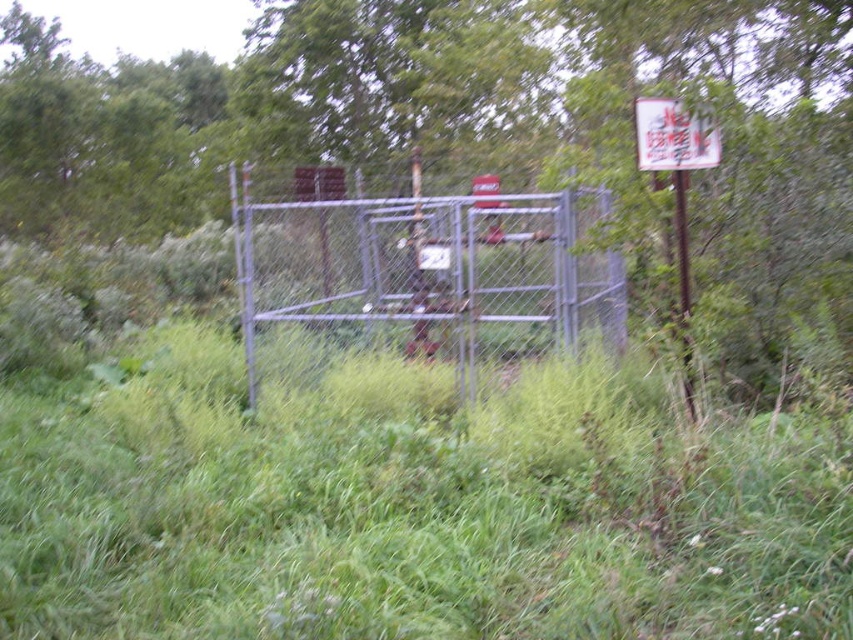
Is green grass at center to the left of metallic chain-link fence at center from the viewer's perspective?

Yes, green grass at center is to the left of metallic chain-link fence at center.

Does green grass at center have a greater height compared to metallic chain-link fence at center?

Indeed, green grass at center has a greater height compared to metallic chain-link fence at center.

Which is behind, point (616, 554) or point (379, 284)?

Point (379, 284)

Locate an element on the screen. The height and width of the screenshot is (640, 853). green grass at center is located at coordinates (415, 508).

Can you confirm if green grass at center is wider than white paper sign at upper right?

Indeed, green grass at center has a greater width compared to white paper sign at upper right.

What do you see at coordinates (415, 508) in the screenshot? This screenshot has width=853, height=640. I see `green grass at center` at bounding box center [415, 508].

At what (x,y) coordinates should I click in order to perform the action: click on green grass at center. Please return your answer as a coordinate pair (x, y). Looking at the image, I should click on (415, 508).

Locate an element on the screen. The height and width of the screenshot is (640, 853). green grass at center is located at coordinates (415, 508).

Looking at this image, between green leafy tree at upper center and metallic chain-link fence at center, which one has less height?

metallic chain-link fence at center is shorter.

Image resolution: width=853 pixels, height=640 pixels. Describe the element at coordinates (454, 115) in the screenshot. I see `green leafy tree at upper center` at that location.

Does point (506, 61) come behind point (556, 292)?

That is True.

You are a GUI agent. You are given a task and a screenshot of the screen. Output one action in this format:
    pyautogui.click(x=<x>, y=<y>)
    Task: Click on the green leafy tree at upper center
    The image size is (853, 640).
    Given the screenshot: What is the action you would take?
    pyautogui.click(x=454, y=115)